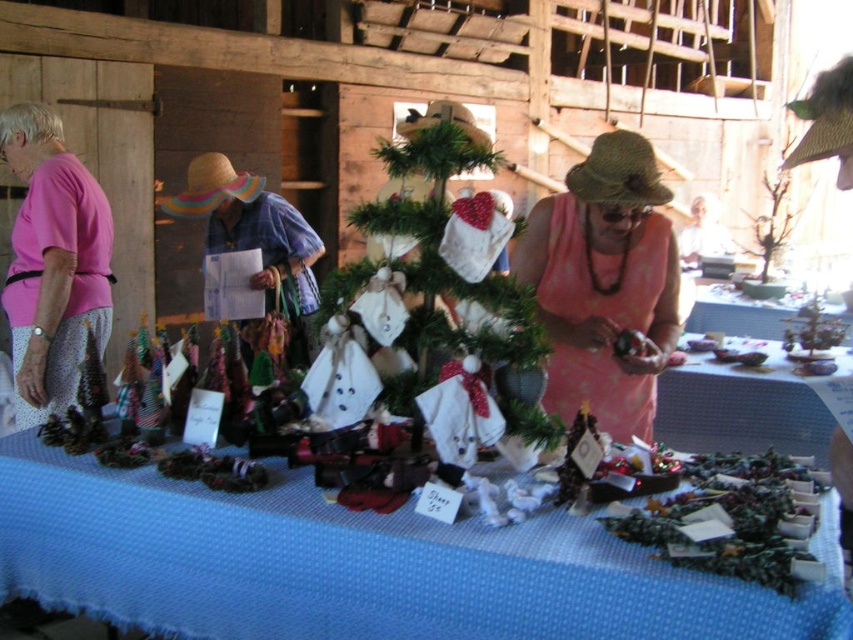
Question: Is metallic silver ornaments at center smaller than metallic silver tray at center?

Choices:
 (A) no
 (B) yes

Answer: (B)

Question: Does pink fabric dress at center come in front of pink fabric shirt at left?

Choices:
 (A) no
 (B) yes

Answer: (B)

Question: Which point appears closest to the camera in this image?

Choices:
 (A) (548, 557)
 (B) (715, 316)

Answer: (A)

Question: In this image, where is blue woven tablecloth at center located relative to pink fabric shirt at left?

Choices:
 (A) right
 (B) left

Answer: (A)

Question: Which is nearer to the pink fabric shirt at left?

Choices:
 (A) pink fabric dress at center
 (B) metallic silver ornaments at center

Answer: (A)

Question: Which object is positioned farthest from the blue woven tablecloth at center?

Choices:
 (A) metallic silver ornaments at center
 (B) metallic silver tray at center
 (C) pink fabric shirt at left
 (D) pink fabric dress at center

Answer: (B)